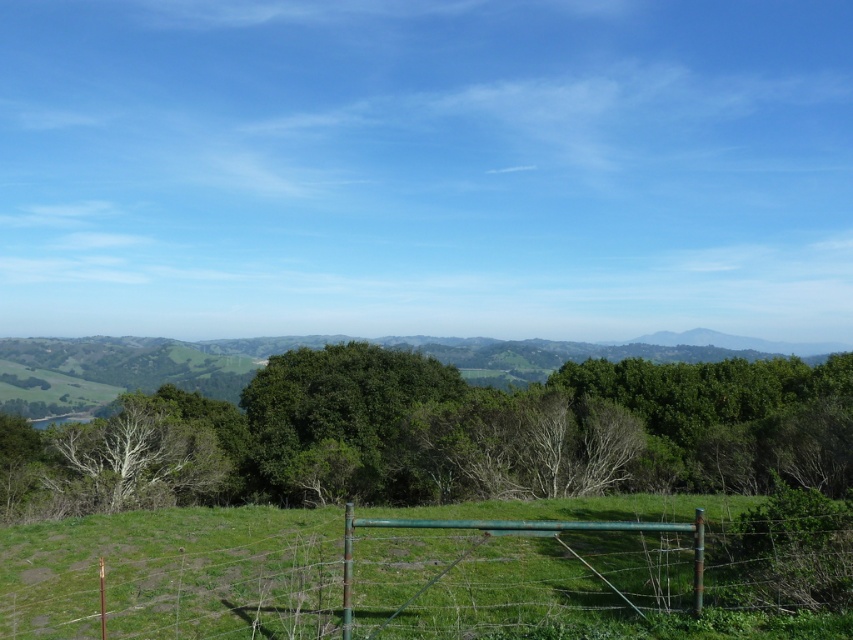
You are standing in the field and want to walk through the green metal gate at center. However, there is a green leafy tree at center blocking your path. Can you walk through the gate without going around the tree?

The green metal gate at center is behind the green leafy tree at center, so you cannot walk through the gate without going around the tree.

You are a farmer standing at the edge of your property and notice both the green leafy tree at center and the green metal gate at center. Which object would block your view more if you were to stand directly in front of them?

The green leafy tree at center is bigger than the green metal gate at center, so it would block your view more than the green metal gate at center.